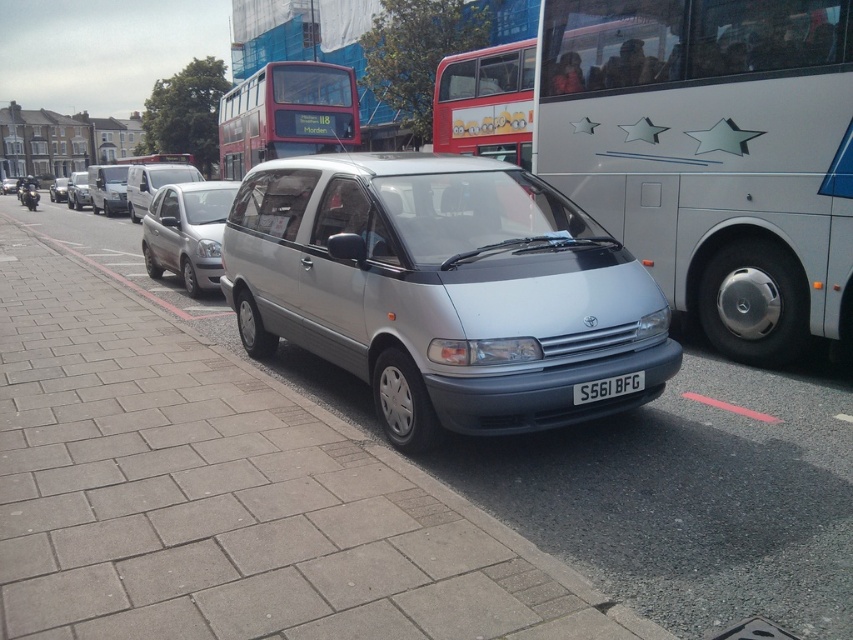
In order to click on silver metallic sedan at center in this screenshot , I will do `click(187, 232)`.

Which is behind, point (200, 250) or point (108, 196)?

Positioned behind is point (108, 196).

Does point (193, 204) come closer to viewer compared to point (102, 202)?

That is True.

Identify the location of silver metallic sedan at center. The width and height of the screenshot is (853, 640). (187, 232).

Which of these two, satin silver minivan at center or silver metallic sedan at center, stands taller?

With more height is satin silver minivan at center.

Can you confirm if satin silver minivan at center is thinner than silver metallic sedan at center?

Incorrect, satin silver minivan at center's width is not less than silver metallic sedan at center's.

Who is more forward, (x=553, y=362) or (x=192, y=289)?

Point (x=553, y=362)

Locate an element on the screen. The image size is (853, 640). satin silver minivan at center is located at coordinates (442, 291).

Which is more to the right, gray concrete pavement at center or black plastic license plate at center?

black plastic license plate at center

The image size is (853, 640). Describe the element at coordinates (225, 493) in the screenshot. I see `gray concrete pavement at center` at that location.

Who is more distant from viewer, [126,500] or [589,397]?

Point [589,397]

Where is `gray concrete pavement at center`? gray concrete pavement at center is located at coordinates (225, 493).